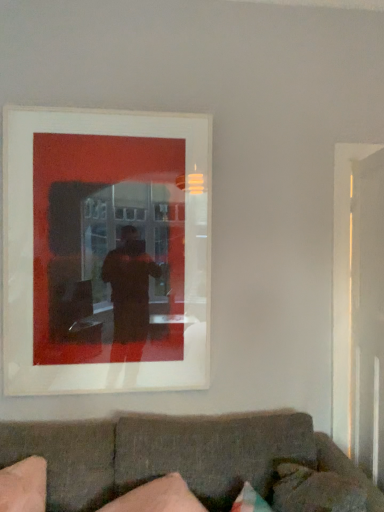
Locate an element on the screen. velvet pink pillow at lower right, which appears as the first pillow when viewed from the right is located at coordinates (315, 490).

Image resolution: width=384 pixels, height=512 pixels. Describe the element at coordinates (173, 455) in the screenshot. I see `dark gray fabric couch at lower center` at that location.

Identify the location of velvet pink pillow at lower right, which appears as the first pillow when viewed from the right. The image size is (384, 512). (315, 490).

Is velvet pink pillow at lower right, which appears as the first pillow when viewed from the right, surrounding matte white picture frame at upper center?

That's incorrect, matte white picture frame at upper center is not inside velvet pink pillow at lower right, which appears as the first pillow when viewed from the right.

From a real-world perspective, is velvet pink pillow at lower right, which appears as the first pillow when viewed from the right, under matte white picture frame at upper center?

Yes, from a real-world perspective, velvet pink pillow at lower right, which appears as the first pillow when viewed from the right, is beneath matte white picture frame at upper center.

From the picture: From the image's perspective, which one is positioned lower, velvet pink pillow at lower right, placed as the second pillow when sorted from left to right, or matte white picture frame at upper center?

velvet pink pillow at lower right, placed as the second pillow when sorted from left to right, from the image's perspective.

Is velvet pink pillow at lower right, placed as the second pillow when sorted from left to right, to the left or to the right of matte white picture frame at upper center in the image?

Based on their positions, velvet pink pillow at lower right, placed as the second pillow when sorted from left to right, is located to the right of matte white picture frame at upper center.

Would you say matte white picture frame at upper center is to the left or to the right of pink fabric pillow at lower left, which ranks as the first pillow in left-to-right order, in the picture?

In the image, matte white picture frame at upper center appears on the left side of pink fabric pillow at lower left, which ranks as the first pillow in left-to-right order.

Can you tell me how much matte white picture frame at upper center and pink fabric pillow at lower left, which ranks as the first pillow in left-to-right order, differ in facing direction?

The angular difference between matte white picture frame at upper center and pink fabric pillow at lower left, which ranks as the first pillow in left-to-right order, is 22.8 degrees.

Is point (190, 293) closer to camera compared to point (165, 502)?

No.

How much distance is there between matte white picture frame at upper center and pink fabric pillow at lower left, which ranks as the first pillow in left-to-right order?

matte white picture frame at upper center is 37.55 inches away from pink fabric pillow at lower left, which ranks as the first pillow in left-to-right order.

Which of these two, transparent glass door at right or matte white picture frame at upper center, is smaller?

Smaller between the two is matte white picture frame at upper center.

Does point (365, 362) appear closer or farther from the camera than point (192, 345)?

Point (365, 362).

Can you confirm if transparent glass door at right is thinner than matte white picture frame at upper center?

In fact, transparent glass door at right might be wider than matte white picture frame at upper center.

Does transparent glass door at right come behind matte white picture frame at upper center?

No, it is in front of matte white picture frame at upper center.

Consider the image. Is dark gray fabric couch at lower center oriented towards velvet pink pillow at lower right, which appears as the first pillow when viewed from the right?

Yes.

From a real-world perspective, between dark gray fabric couch at lower center and velvet pink pillow at lower right, placed as the second pillow when sorted from left to right, who is vertically higher?

velvet pink pillow at lower right, placed as the second pillow when sorted from left to right, from a real-world perspective.

Considering the positions of point (143, 435) and point (298, 472), is point (143, 435) closer or farther from the camera than point (298, 472)?

Point (143, 435) is positioned farther from the camera compared to point (298, 472).

In the image, is dark gray fabric couch at lower center on the left side or the right side of velvet pink pillow at lower right, which appears as the first pillow when viewed from the right?

From the image, it's evident that dark gray fabric couch at lower center is to the left of velvet pink pillow at lower right, which appears as the first pillow when viewed from the right.

Considering the sizes of matte white picture frame at upper center and transparent glass door at right in the image, is matte white picture frame at upper center wider or thinner than transparent glass door at right?

In the image, matte white picture frame at upper center appears to be more narrow than transparent glass door at right.

Is matte white picture frame at upper center facing towards transparent glass door at right?

No, matte white picture frame at upper center is not facing towards transparent glass door at right.

Is matte white picture frame at upper center not within transparent glass door at right?

That's correct, matte white picture frame at upper center is outside of transparent glass door at right.

Does velvet pink pillow at lower right, placed as the second pillow when sorted from left to right, have a smaller size compared to pink fabric pillow at lower left, acting as the second pillow starting from the right?

Correct, velvet pink pillow at lower right, placed as the second pillow when sorted from left to right, occupies less space than pink fabric pillow at lower left, acting as the second pillow starting from the right.

Locate an element on the screen. pillow that is in front of the velvet pink pillow at lower right, which appears as the first pillow when viewed from the right is located at coordinates (157, 497).

Can you tell me how much velvet pink pillow at lower right, which appears as the first pillow when viewed from the right, and pink fabric pillow at lower left, which ranks as the first pillow in left-to-right order, differ in facing direction?

There is a 78-degree angle between the facing directions of velvet pink pillow at lower right, which appears as the first pillow when viewed from the right, and pink fabric pillow at lower left, which ranks as the first pillow in left-to-right order.

Looking at this image, does dark gray fabric couch at lower center contain transparent glass door at right?

Definitely not — transparent glass door at right is not inside dark gray fabric couch at lower center.

Can you confirm if dark gray fabric couch at lower center is shorter than transparent glass door at right?

Indeed, dark gray fabric couch at lower center has a lesser height compared to transparent glass door at right.

What's the angular difference between dark gray fabric couch at lower center and transparent glass door at right's facing directions?

There is a 82-degree angle between the facing directions of dark gray fabric couch at lower center and transparent glass door at right.

Is dark gray fabric couch at lower center smaller than transparent glass door at right?

Actually, dark gray fabric couch at lower center might be larger than transparent glass door at right.

Identify the location of picture frame that appears on the left of velvet pink pillow at lower right, placed as the second pillow when sorted from left to right. (106, 251).

Identify the location of picture frame above the pink fabric pillow at lower left, which ranks as the first pillow in left-to-right order (from a real-world perspective). (106, 251).

Estimate the real-world distances between objects in this image. Which object is further from velvet pink pillow at lower right, placed as the second pillow when sorted from left to right, pink fabric pillow at lower left, acting as the second pillow starting from the right, or transparent glass door at right?

The object further to velvet pink pillow at lower right, placed as the second pillow when sorted from left to right, is transparent glass door at right.

Estimate the real-world distances between objects in this image. Which object is closer to dark gray fabric couch at lower center, pink fabric pillow at lower left, acting as the second pillow starting from the right, or velvet pink pillow at lower right, which appears as the first pillow when viewed from the right?

pink fabric pillow at lower left, acting as the second pillow starting from the right, lies closer to dark gray fabric couch at lower center than the other object.

Consider the image. Looking at the image, which one is located further to matte white picture frame at upper center, velvet pink pillow at lower right, which appears as the first pillow when viewed from the right, or transparent glass door at right?

transparent glass door at right is positioned further to the anchor matte white picture frame at upper center.

Based on the photo, which object lies nearer to the anchor point matte white picture frame at upper center, pink fabric pillow at lower left, acting as the second pillow starting from the right, or dark gray fabric couch at lower center?

dark gray fabric couch at lower center is closer to matte white picture frame at upper center.

Considering their positions, is transparent glass door at right positioned further to pink fabric pillow at lower left, acting as the second pillow starting from the right, than velvet pink pillow at lower right, placed as the second pillow when sorted from left to right?

The object further to pink fabric pillow at lower left, acting as the second pillow starting from the right, is transparent glass door at right.

Which object lies further to the anchor point transparent glass door at right, velvet pink pillow at lower right, which appears as the first pillow when viewed from the right, or pink fabric pillow at lower left, which ranks as the first pillow in left-to-right order?

Based on the image, pink fabric pillow at lower left, which ranks as the first pillow in left-to-right order, appears to be further to transparent glass door at right.

Which object lies nearer to the anchor point dark gray fabric couch at lower center, velvet pink pillow at lower right, placed as the second pillow when sorted from left to right, or transparent glass door at right?

Among the two, velvet pink pillow at lower right, placed as the second pillow when sorted from left to right, is located nearer to dark gray fabric couch at lower center.

From the picture: Which object lies further to the anchor point matte white picture frame at upper center, dark gray fabric couch at lower center or pink fabric pillow at lower left, acting as the second pillow starting from the right?

pink fabric pillow at lower left, acting as the second pillow starting from the right, is further to matte white picture frame at upper center.

Identify the location of pillow situated between dark gray fabric couch at lower center and transparent glass door at right from left to right. (315, 490).

Identify the location of pillow between pink fabric pillow at lower left, acting as the second pillow starting from the right, and transparent glass door at right. (315, 490).

I want to click on studio couch located between pink fabric pillow at lower left, acting as the second pillow starting from the right, and transparent glass door at right in the left-right direction, so click(x=173, y=455).

Where is `pillow between matte white picture frame at upper center and pink fabric pillow at lower left, which ranks as the first pillow in left-to-right order, in the up-down direction`? pillow between matte white picture frame at upper center and pink fabric pillow at lower left, which ranks as the first pillow in left-to-right order, in the up-down direction is located at coordinates (315, 490).